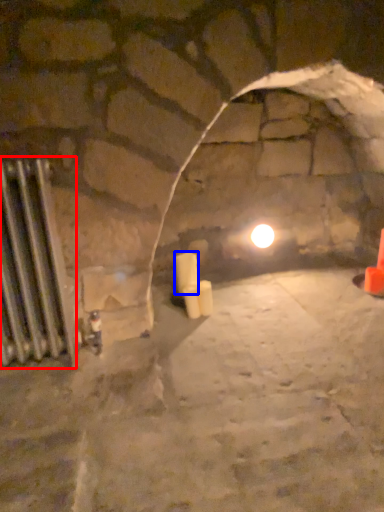
Question: Which object is further to the camera taking this photo, radiator (highlighted by a red box) or candle (highlighted by a blue box)?

Choices:
 (A) radiator
 (B) candle

Answer: (B)